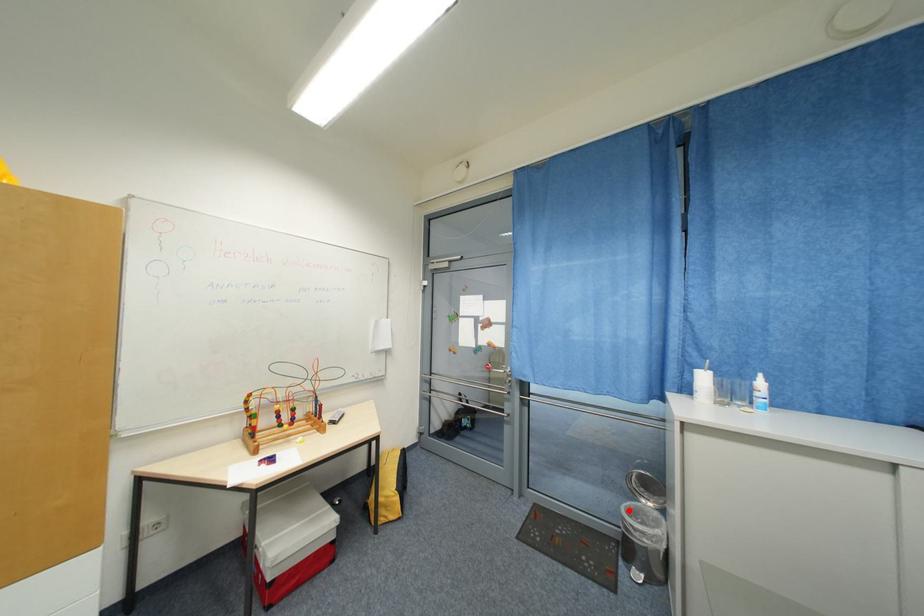
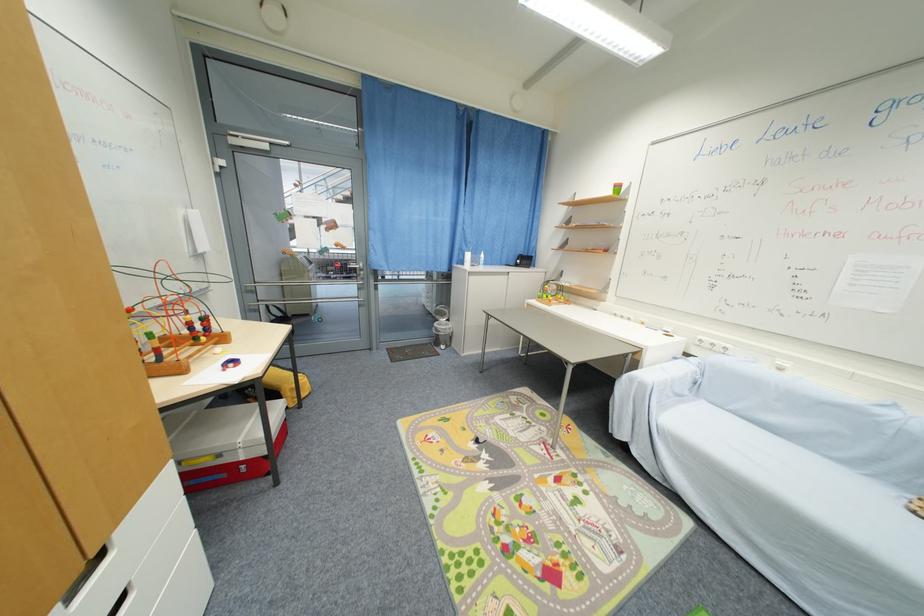
Find the pixel in the second image that matches the highlighted location in the first image.

(441, 326)